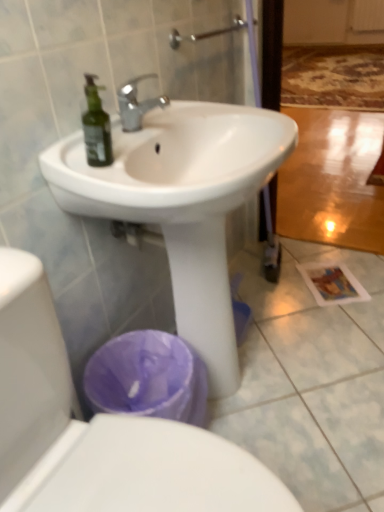
Question: In the image, is white glossy sink at center on the left side or the right side of white glossy toilet at lower left?

Choices:
 (A) right
 (B) left

Answer: (A)

Question: Which is correct: white glossy sink at center is inside white glossy toilet at lower left, or outside of it?

Choices:
 (A) inside
 (B) outside

Answer: (B)

Question: Does point (183, 181) appear closer or farther from the camera than point (56, 386)?

Choices:
 (A) farther
 (B) closer

Answer: (A)

Question: Considering the positions of white glossy toilet at lower left and white glossy sink at center in the image, is white glossy toilet at lower left wider or thinner than white glossy sink at center?

Choices:
 (A) wide
 (B) thin

Answer: (A)

Question: Is point (28, 258) positioned closer to the camera than point (196, 324)?

Choices:
 (A) farther
 (B) closer

Answer: (B)

Question: Considering their positions, is white glossy toilet at lower left located in front of or behind white glossy sink at center?

Choices:
 (A) behind
 (B) front

Answer: (B)

Question: Considering the relative positions of white glossy toilet at lower left and white glossy sink at center in the image provided, is white glossy toilet at lower left to the left or to the right of white glossy sink at center?

Choices:
 (A) right
 (B) left

Answer: (B)